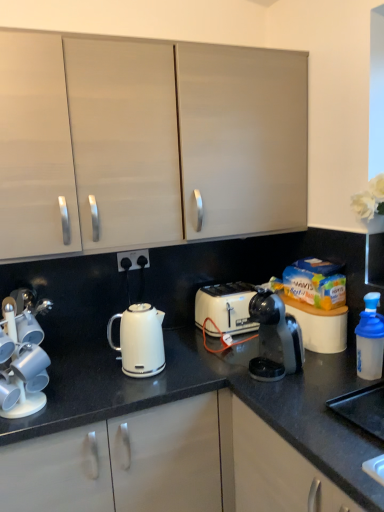
The height and width of the screenshot is (512, 384). I want to click on black plastic coffee maker at center, so click(275, 336).

The image size is (384, 512). Describe the element at coordinates (133, 259) in the screenshot. I see `black plastic electrical outlet at center` at that location.

Find the location of a particular element. white glossy kettle at center is located at coordinates (140, 340).

The width and height of the screenshot is (384, 512). I want to click on white glossy cup holder at left, so click(x=22, y=356).

Could you tell me if white glossy cup holder at left is turned towards white plastic toaster at center?

No, white glossy cup holder at left is not turned towards white plastic toaster at center.

Are white glossy cup holder at left and white plastic toaster at center far apart?

They are positioned close to each other.

Which is more to the left, white glossy cup holder at left or white plastic toaster at center?

white glossy cup holder at left.

From a real-world perspective, who is located lower, white glossy cup holder at left or white plastic toaster at center?

white plastic toaster at center, from a real-world perspective.

From the image's perspective, between white plastic toaster at center and black granite countertop at center, which one is located above?

white plastic toaster at center is shown above in the image.

Is white plastic toaster at center not inside black granite countertop at center?

Yes, white plastic toaster at center is not within black granite countertop at center.

Are white plastic toaster at center and black granite countertop at center far apart?

That's not correct — white plastic toaster at center is a little close to black granite countertop at center.

Is point (234, 282) farther from camera compared to point (299, 408)?

Yes, it is behind point (299, 408).

Considering the sizes of black granite countertop at center and blue translucent bottle at right in the image, is black granite countertop at center bigger or smaller than blue translucent bottle at right?

Considering their sizes, black granite countertop at center takes up more space than blue translucent bottle at right.

Could you tell me if black granite countertop at center is facing blue translucent bottle at right?

No, black granite countertop at center is not facing towards blue translucent bottle at right.

Visually, is black granite countertop at center positioned to the left or to the right of blue translucent bottle at right?

Clearly, black granite countertop at center is on the left of blue translucent bottle at right in the image.

What's the angular difference between black granite countertop at center and blue translucent bottle at right's facing directions?

There is a 89.6-degree angle between the facing directions of black granite countertop at center and blue translucent bottle at right.

Is matte white cabinet at upper center facing towards black plastic electrical outlet at center?

No, matte white cabinet at upper center is not oriented towards black plastic electrical outlet at center.

Can you tell me how much matte white cabinet at upper center and black plastic electrical outlet at center differ in facing direction?

They differ by 0.527 degrees in their facing directions.

Is the depth of matte white cabinet at upper center less than that of black plastic electrical outlet at center?

Yes, matte white cabinet at upper center is closer to the viewer.

Does matte white cabinet at upper center touch black plastic electrical outlet at center?

No, matte white cabinet at upper center is not with black plastic electrical outlet at center.

Is black plastic coffee maker at center bigger than matte white cabinet at upper center?

Incorrect, black plastic coffee maker at center is not larger than matte white cabinet at upper center.

Based on the photo, is black plastic coffee maker at center taller or shorter than matte white cabinet at upper center?

Clearly, black plastic coffee maker at center is shorter compared to matte white cabinet at upper center.

Does black plastic coffee maker at center have a greater width compared to matte white cabinet at upper center?

Incorrect, the width of black plastic coffee maker at center does not surpass that of matte white cabinet at upper center.

Where is `home appliance below the matte white cabinet at upper center (from a real-world perspective)`? home appliance below the matte white cabinet at upper center (from a real-world perspective) is located at coordinates (275, 336).

Which is in front, point (367, 318) or point (295, 343)?

Positioned in front is point (295, 343).

Is blue translucent bottle at right not inside black plastic coffee maker at center?

Yes, blue translucent bottle at right is located beyond the bounds of black plastic coffee maker at center.

From the image's perspective, which is below, white glossy cup holder at left or blue translucent bottle at right?

white glossy cup holder at left, from the image's perspective.

Is white glossy cup holder at left positioned with its back to blue translucent bottle at right?

No.

Identify the location of kitchen appliance that is above the blue translucent bottle at right (from a real-world perspective). Image resolution: width=384 pixels, height=512 pixels. (22, 356).

Is white glossy cup holder at left at the right side of blue translucent bottle at right?

No.

Where is `toaster behind the white glossy cup holder at left`? The height and width of the screenshot is (512, 384). toaster behind the white glossy cup holder at left is located at coordinates (226, 307).

In order to click on toaster above the black granite countertop at center (from a real-world perspective) in this screenshot , I will do `click(226, 307)`.

Considering their positions, is black plastic coffee maker at center positioned closer to black granite countertop at center than white glossy kettle at center?

black plastic coffee maker at center is closer to black granite countertop at center.

Estimate the real-world distances between objects in this image. Which object is further from white glossy kettle at center, white glossy cup holder at left or black granite countertop at center?

white glossy cup holder at left lies further to white glossy kettle at center than the other object.

From the picture: When comparing their distances from black plastic coffee maker at center, does blue translucent bottle at right or white glossy cup holder at left seem closer?

The object closer to black plastic coffee maker at center is blue translucent bottle at right.

In the scene shown: Looking at the image, which one is located further to black granite countertop at center, black plastic electrical outlet at center or white plastic toaster at center?

black plastic electrical outlet at center lies further to black granite countertop at center than the other object.

Estimate the real-world distances between objects in this image. Which object is further from matte white cabinet at upper center, white glossy cup holder at left or black plastic coffee maker at center?

The object further to matte white cabinet at upper center is black plastic coffee maker at center.

Based on their spatial positions, is black plastic electrical outlet at center or white glossy kettle at center closer to black plastic coffee maker at center?

white glossy kettle at center.

Which object lies further to the anchor point matte white cabinet at upper center, white plastic toaster at center or black plastic electrical outlet at center?

white plastic toaster at center lies further to matte white cabinet at upper center than the other object.

Looking at the image, which one is located further to black plastic coffee maker at center, matte white cabinet at upper center or white glossy kettle at center?

The object further to black plastic coffee maker at center is matte white cabinet at upper center.

This screenshot has height=512, width=384. In order to click on kettle between black plastic electrical outlet at center and blue translucent bottle at right in this screenshot , I will do `click(140, 340)`.

Find the location of `toaster situated between white glossy cup holder at left and blue translucent bottle at right from left to right`. toaster situated between white glossy cup holder at left and blue translucent bottle at right from left to right is located at coordinates (226, 307).

At what (x,y) coordinates should I click in order to perform the action: click on toaster between black granite countertop at center and blue translucent bottle at right from left to right. Please return your answer as a coordinate pair (x, y). Looking at the image, I should click on (226, 307).

The height and width of the screenshot is (512, 384). Identify the location of home appliance between black plastic electrical outlet at center and black granite countertop at center in the vertical direction. (275, 336).